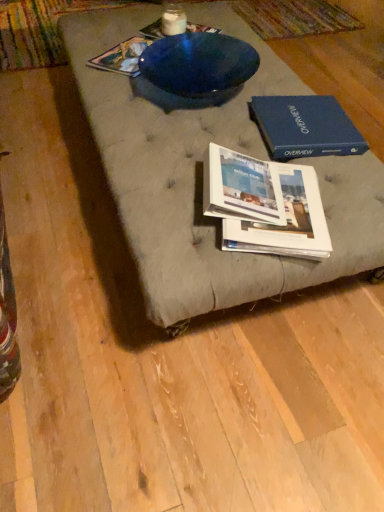
Image resolution: width=384 pixels, height=512 pixels. What are the coordinates of `free spot above white glossy book at center, which is the 3th book from back to front (from a real-world perspective)` in the screenshot? It's located at (284, 194).